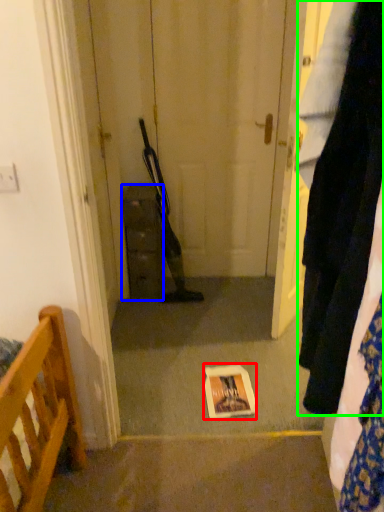
Question: Considering the real-world distances, which object is farthest from copy (highlighted by a red box)? cabinetry (highlighted by a blue box) or clothing (highlighted by a green box)?

Choices:
 (A) cabinetry
 (B) clothing

Answer: (B)